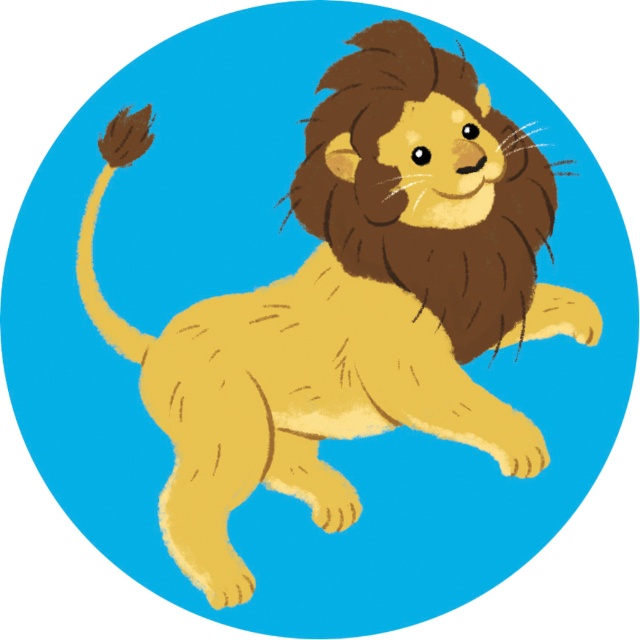
Can you confirm if brown fuzzy mane at center is positioned to the left of brown fuzzy tail at upper left?

Incorrect, brown fuzzy mane at center is not on the left side of brown fuzzy tail at upper left.

Between brown fuzzy mane at center and brown fuzzy tail at upper left, which one appears on the right side from the viewer's perspective?

Positioned to the right is brown fuzzy mane at center.

Does point (352, 88) come in front of point (120, 138)?

Yes, it is in front of point (120, 138).

Locate an element on the screen. Image resolution: width=640 pixels, height=640 pixels. brown fuzzy mane at center is located at coordinates (403, 193).